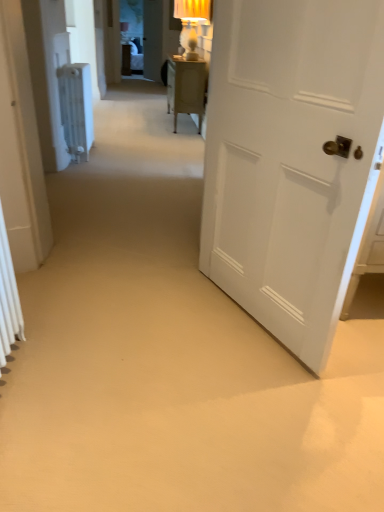
Question: Does white matte radiator at left, acting as the first door starting from the left, touch white plastic radiator at left?

Choices:
 (A) no
 (B) yes

Answer: (A)

Question: Is white matte radiator at left, which is the second door from right to left, positioned in front of white plastic radiator at left?

Choices:
 (A) yes
 (B) no

Answer: (A)

Question: Is the position of white matte radiator at left, which is the second door from right to left, more distant than that of white plastic radiator at left?

Choices:
 (A) yes
 (B) no

Answer: (B)

Question: From a real-world perspective, is white matte radiator at left, which is counted as the first door, starting from the back, positioned under white plastic radiator at left based on gravity?

Choices:
 (A) yes
 (B) no

Answer: (B)

Question: Is white matte radiator at left, which is the second door from right to left, looking in the opposite direction of white plastic radiator at left?

Choices:
 (A) no
 (B) yes

Answer: (A)

Question: Considering the positions of white matte door at right, the 1th door viewed from the right, and white matte radiator at left, which is counted as the first door, starting from the back, in the image, is white matte door at right, the 1th door viewed from the right, taller or shorter than white matte radiator at left, which is counted as the first door, starting from the back,?

Choices:
 (A) short
 (B) tall

Answer: (B)

Question: From the image's perspective, is white matte door at right, which is the 1th door in front-to-back order, above or below white matte radiator at left, acting as the first door starting from the left?

Choices:
 (A) above
 (B) below

Answer: (B)

Question: Considering the positions of white matte door at right, the 1th door viewed from the right, and white matte radiator at left, acting as the first door starting from the left, in the image, is white matte door at right, the 1th door viewed from the right, wider or thinner than white matte radiator at left, acting as the first door starting from the left,?

Choices:
 (A) thin
 (B) wide

Answer: (B)

Question: From a real-world perspective, is white matte door at right, the 1th door viewed from the right, positioned above or below white matte radiator at left, which is the second door in front-to-back order?

Choices:
 (A) above
 (B) below

Answer: (B)

Question: Based on their sizes in the image, would you say white matte door at right, acting as the second door starting from the left, is bigger or smaller than white plastic radiator at left?

Choices:
 (A) small
 (B) big

Answer: (B)

Question: Is white matte door at right, which is the 1th door in front-to-back order, inside or outside of white plastic radiator at left?

Choices:
 (A) inside
 (B) outside

Answer: (B)

Question: From the image's perspective, relative to white plastic radiator at left, is white matte door at right, which is the 1th door in front-to-back order, above or below?

Choices:
 (A) below
 (B) above

Answer: (A)

Question: In the image, is white matte door at right, which is the 1th door in front-to-back order, positioned in front of or behind white plastic radiator at left?

Choices:
 (A) front
 (B) behind

Answer: (A)

Question: Is white plastic radiator at left inside the boundaries of white matte door at right, acting as the second door starting from the left, or outside?

Choices:
 (A) outside
 (B) inside

Answer: (A)

Question: From the image's perspective, relative to white matte door at right, the 1th door viewed from the right, is white plastic radiator at left above or below?

Choices:
 (A) below
 (B) above

Answer: (B)